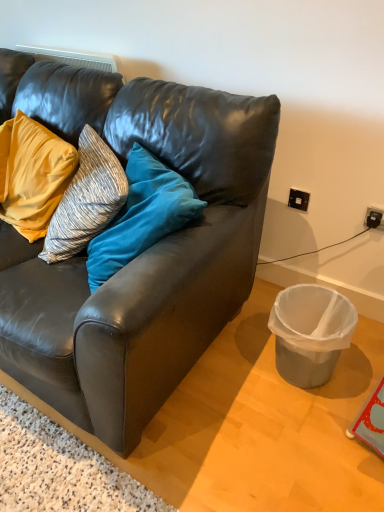
Question: Do you think black plastic power outlet at upper right, marked as the first power outlet in a top-to-bottom arrangement, is within metallic gray trash can at lower right, or outside of it?

Choices:
 (A) outside
 (B) inside

Answer: (A)

Question: From a real-world perspective, relative to metallic gray trash can at lower right, is black plastic power outlet at upper right, the second power outlet positioned from the bottom, vertically above or below?

Choices:
 (A) above
 (B) below

Answer: (A)

Question: Which object is the farthest from the matte yellow pillow at upper left?

Choices:
 (A) black plastic power outlet at upper right, which is the 2th power outlet in right-to-left order
 (B) matte black couch at center
 (C) metallic gray trash can at lower right
 (D) black plastic power outlet at upper right, marked as the 2th power outlet in a back-to-front arrangement

Answer: (D)

Question: Estimate the real-world distances between objects in this image. Which object is closer to the metallic gray trash can at lower right?

Choices:
 (A) black plastic power outlet at upper right, the 2th power outlet viewed from the left
 (B) black plastic power outlet at upper right, which ranks as the first power outlet in left-to-right order
 (C) matte yellow pillow at upper left
 (D) matte black couch at center

Answer: (A)